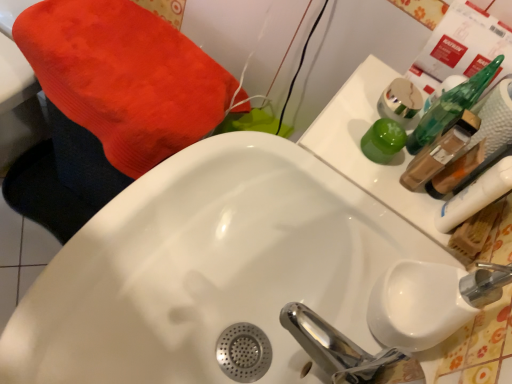
How much space does translucent plastic mouthwash at upper right, the 2th mouthwash ordered from the bottom, occupy vertically?

translucent plastic mouthwash at upper right, the 2th mouthwash ordered from the bottom, is 5.02 inches tall.

Locate an element on the screen. The width and height of the screenshot is (512, 384). white glossy sink at center is located at coordinates (208, 268).

Where is `mouthwash that is the 2nd object located above the white glossy sink at center (from the image's perspective)`? This screenshot has height=384, width=512. mouthwash that is the 2nd object located above the white glossy sink at center (from the image's perspective) is located at coordinates (440, 150).

Which object is positioned more to the right, translucent plastic mouthwash at upper right, the 2th mouthwash ordered from the bottom, or white glossy sink at center?

translucent plastic mouthwash at upper right, the 2th mouthwash ordered from the bottom, is more to the right.

Is translucent plastic mouthwash at upper right, the 2th mouthwash ordered from the bottom, positioned with its back to white glossy sink at center?

No, white glossy sink at center is not at the back of translucent plastic mouthwash at upper right, the 2th mouthwash ordered from the bottom.

Between translucent plastic mouthwash at upper right, which is the 3th mouthwash in top-to-bottom order, and white glossy sink at center, which one has more height?

Standing taller between the two is white glossy sink at center.

Is translucent plastic mouthwash at right, which appears as the 1th mouthwash when ordered from the bottom, oriented away from white glossy sink at center?

translucent plastic mouthwash at right, which appears as the 1th mouthwash when ordered from the bottom, is not turned away from white glossy sink at center.

Does translucent plastic mouthwash at right, which appears as the 1th mouthwash when ordered from the bottom, have a lesser width compared to white glossy sink at center?

Yes.

Does translucent plastic mouthwash at right, which appears as the fourth mouthwash when viewed from the top, come behind white glossy sink at center?

Yes, translucent plastic mouthwash at right, which appears as the fourth mouthwash when viewed from the top, is behind white glossy sink at center.

Is translucent plastic mouthwash at right, which appears as the 1th mouthwash when ordered from the bottom, bigger or smaller than white glossy sink at center?

Considering their sizes, translucent plastic mouthwash at right, which appears as the 1th mouthwash when ordered from the bottom, takes up less space than white glossy sink at center.

Is translucent plastic mouthwash at right, which appears as the fourth mouthwash when viewed from the top, a part of translucent plastic mouthwash at upper right, which is the 3th mouthwash in top-to-bottom order?

No, translucent plastic mouthwash at right, which appears as the fourth mouthwash when viewed from the top, is not surrounded by translucent plastic mouthwash at upper right, which is the 3th mouthwash in top-to-bottom order.

From a real-world perspective, between translucent plastic mouthwash at upper right, the 2th mouthwash ordered from the bottom, and translucent plastic mouthwash at right, which appears as the fourth mouthwash when viewed from the top, who is vertically lower?

translucent plastic mouthwash at upper right, the 2th mouthwash ordered from the bottom.

Is translucent plastic mouthwash at upper right, which is the 3th mouthwash in top-to-bottom order, wider than translucent plastic mouthwash at right, which appears as the fourth mouthwash when viewed from the top?

Yes.

Which of these two, white glossy sink at center or translucent plastic mouthwash at upper right, the 2th mouthwash ordered from the bottom, stands taller?

white glossy sink at center.

Is white glossy sink at center not close to translucent plastic mouthwash at upper right, which is the 3th mouthwash in top-to-bottom order?

No, white glossy sink at center is not far from translucent plastic mouthwash at upper right, which is the 3th mouthwash in top-to-bottom order.

Is white glossy sink at center to the left of translucent plastic mouthwash at upper right, which is the 3th mouthwash in top-to-bottom order, from the viewer's perspective?

Yes, white glossy sink at center is to the left of translucent plastic mouthwash at upper right, which is the 3th mouthwash in top-to-bottom order.

Can you tell me how much white glossy sink at center and translucent plastic mouthwash at upper right, which is the 3th mouthwash in top-to-bottom order, differ in facing direction?

0.000459 degrees separate the facing orientations of white glossy sink at center and translucent plastic mouthwash at upper right, which is the 3th mouthwash in top-to-bottom order.

What's the angular difference between metallic gold mouthwash at upper right, marked as the first mouthwash in a top-to-bottom arrangement, and white glossy sink at center's facing directions?

They differ by 0.000517 degrees in their facing directions.

From the image's perspective, is metallic gold mouthwash at upper right, which is counted as the 4th mouthwash, starting from the bottom, above or below white glossy sink at center?

From the image's perspective, metallic gold mouthwash at upper right, which is counted as the 4th mouthwash, starting from the bottom, appears above white glossy sink at center.

Can you confirm if metallic gold mouthwash at upper right, marked as the first mouthwash in a top-to-bottom arrangement, is wider than white glossy sink at center?

In fact, metallic gold mouthwash at upper right, marked as the first mouthwash in a top-to-bottom arrangement, might be narrower than white glossy sink at center.

Is metallic gold mouthwash at upper right, which is counted as the 4th mouthwash, starting from the bottom, placed right next to white glossy sink at center?

No, metallic gold mouthwash at upper right, which is counted as the 4th mouthwash, starting from the bottom, is not with white glossy sink at center.

From the image's perspective, is translucent plastic mouthwash at upper right, the 2th mouthwash ordered from the bottom, on metallic gold mouthwash at upper right, which is counted as the 4th mouthwash, starting from the bottom?

Actually, translucent plastic mouthwash at upper right, the 2th mouthwash ordered from the bottom, appears below metallic gold mouthwash at upper right, which is counted as the 4th mouthwash, starting from the bottom, in the image.

Considering the points (435, 145) and (383, 91), which point is in front, point (435, 145) or point (383, 91)?

The point (435, 145) is closer to the camera.

In the scene shown: Considering the sizes of translucent plastic mouthwash at upper right, which is the 3th mouthwash in top-to-bottom order, and metallic gold mouthwash at upper right, which is counted as the 4th mouthwash, starting from the bottom, in the image, is translucent plastic mouthwash at upper right, which is the 3th mouthwash in top-to-bottom order, taller or shorter than metallic gold mouthwash at upper right, which is counted as the 4th mouthwash, starting from the bottom,?

In the image, translucent plastic mouthwash at upper right, which is the 3th mouthwash in top-to-bottom order, appears to be taller than metallic gold mouthwash at upper right, which is counted as the 4th mouthwash, starting from the bottom.

Considering the relative positions of green glossy cup at upper right, which is counted as the third mouthwash, starting from the bottom, and white glossy sink at center in the image provided, is green glossy cup at upper right, which is counted as the third mouthwash, starting from the bottom, to the right of white glossy sink at center from the viewer's perspective?

Yes.

Considering the points (361, 146) and (278, 236), which point is in front, point (361, 146) or point (278, 236)?

The point (278, 236) is in front.

Looking at this image, between green glossy cup at upper right, arranged as the second mouthwash when viewed from the top, and white glossy sink at center, which one has larger width?

With larger width is white glossy sink at center.

This screenshot has width=512, height=384. There is a white glossy sink at center. In order to click on the 3rd mouthwash above it (from a real-world perspective) in this screenshot , I will do `click(440, 150)`.

Find the location of a particular element. sink on the left of translucent plastic mouthwash at right, which appears as the fourth mouthwash when viewed from the top is located at coordinates (208, 268).

When comparing their distances from translucent plastic mouthwash at right, which appears as the fourth mouthwash when viewed from the top, does translucent plastic mouthwash at upper right, the 2th mouthwash ordered from the bottom, or metallic gold mouthwash at upper right, which is counted as the 4th mouthwash, starting from the bottom, seem further?

metallic gold mouthwash at upper right, which is counted as the 4th mouthwash, starting from the bottom, is positioned further to the anchor translucent plastic mouthwash at right, which appears as the fourth mouthwash when viewed from the top.

Consider the image. Based on their spatial positions, is translucent plastic mouthwash at upper right, the 2th mouthwash ordered from the bottom, or translucent plastic mouthwash at right, which appears as the 1th mouthwash when ordered from the bottom, further from green glossy cup at upper right, which is counted as the third mouthwash, starting from the bottom?

translucent plastic mouthwash at right, which appears as the 1th mouthwash when ordered from the bottom, is positioned further to the anchor green glossy cup at upper right, which is counted as the third mouthwash, starting from the bottom.

From the image, which object appears to be nearer to white glossy sink at center, green glossy cup at upper right, which is counted as the third mouthwash, starting from the bottom, or metallic gold mouthwash at upper right, marked as the first mouthwash in a top-to-bottom arrangement?

green glossy cup at upper right, which is counted as the third mouthwash, starting from the bottom, is closer to white glossy sink at center.

Based on the photo, looking at the image, which one is located closer to translucent plastic mouthwash at upper right, which is the 3th mouthwash in top-to-bottom order, metallic gold mouthwash at upper right, marked as the first mouthwash in a top-to-bottom arrangement, or translucent plastic mouthwash at right, which appears as the fourth mouthwash when viewed from the top?

translucent plastic mouthwash at right, which appears as the fourth mouthwash when viewed from the top.

Estimate the real-world distances between objects in this image. Which object is closer to white glossy sink at center, translucent plastic mouthwash at right, which appears as the 1th mouthwash when ordered from the bottom, or translucent plastic mouthwash at upper right, which is the 3th mouthwash in top-to-bottom order?

translucent plastic mouthwash at upper right, which is the 3th mouthwash in top-to-bottom order, lies closer to white glossy sink at center than the other object.

From the image, which object appears to be nearer to green glossy cup at upper right, which is counted as the third mouthwash, starting from the bottom, white glossy sink at center or translucent plastic mouthwash at right, which appears as the 1th mouthwash when ordered from the bottom?

translucent plastic mouthwash at right, which appears as the 1th mouthwash when ordered from the bottom, lies closer to green glossy cup at upper right, which is counted as the third mouthwash, starting from the bottom, than the other object.

Based on their spatial positions, is metallic gold mouthwash at upper right, marked as the first mouthwash in a top-to-bottom arrangement, or translucent plastic mouthwash at upper right, which is the 3th mouthwash in top-to-bottom order, further from green glossy cup at upper right, which is counted as the third mouthwash, starting from the bottom?

The object further to green glossy cup at upper right, which is counted as the third mouthwash, starting from the bottom, is metallic gold mouthwash at upper right, marked as the first mouthwash in a top-to-bottom arrangement.

From the image, which object appears to be nearer to metallic gold mouthwash at upper right, which is counted as the 4th mouthwash, starting from the bottom, green glossy cup at upper right, arranged as the second mouthwash when viewed from the top, or translucent plastic mouthwash at upper right, the 2th mouthwash ordered from the bottom?

Based on the image, translucent plastic mouthwash at upper right, the 2th mouthwash ordered from the bottom, appears to be nearer to metallic gold mouthwash at upper right, which is counted as the 4th mouthwash, starting from the bottom.

The image size is (512, 384). I want to click on mouthwash between translucent plastic mouthwash at upper right, which is the 3th mouthwash in top-to-bottom order, and metallic gold mouthwash at upper right, which is counted as the 4th mouthwash, starting from the bottom, along the z-axis, so click(x=383, y=141).